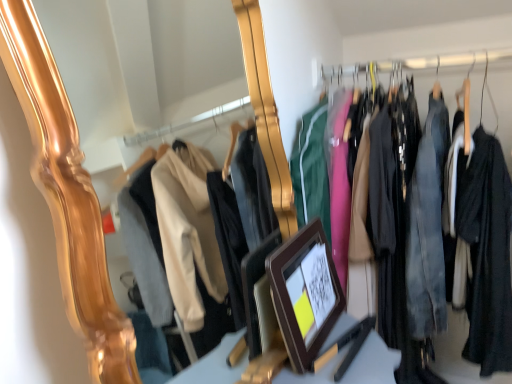
Measure the distance between point (308, 269) and camera.

Point (308, 269) is 1.07 meters from camera.

The image size is (512, 384). Find the location of `brown wooden picture frame at center`. brown wooden picture frame at center is located at coordinates (305, 293).

This screenshot has height=384, width=512. Describe the element at coordinates (305, 293) in the screenshot. I see `brown wooden picture frame at center` at that location.

The height and width of the screenshot is (384, 512). What do you see at coordinates (494, 249) in the screenshot?
I see `matte black jackets at center` at bounding box center [494, 249].

Image resolution: width=512 pixels, height=384 pixels. I want to click on matte black jackets at center, so click(494, 249).

Locate an element on the screen. brown wooden picture frame at center is located at coordinates (305, 293).

Between brown wooden picture frame at center and matte black jackets at center, which one appears on the left side from the viewer's perspective?

From the viewer's perspective, brown wooden picture frame at center appears more on the left side.

In the scene shown: Which is behind, brown wooden picture frame at center or matte black jackets at center?

matte black jackets at center is further from the camera.

Which point is more forward, [304,330] or [502,338]?

The point [304,330] is in front.

Looking at this image, from the image's perspective, is brown wooden picture frame at center located above or below matte black jackets at center?

From the image's perspective, brown wooden picture frame at center appears below matte black jackets at center.

Consider the image. From a real-world perspective, is brown wooden picture frame at center over matte black jackets at center?

No.

Does brown wooden picture frame at center have a lesser width compared to matte black jackets at center?

Indeed, brown wooden picture frame at center has a lesser width compared to matte black jackets at center.

Who is taller, brown wooden picture frame at center or matte black jackets at center?

matte black jackets at center.

Is brown wooden picture frame at center bigger or smaller than matte black jackets at center?

brown wooden picture frame at center is smaller than matte black jackets at center.

Is brown wooden picture frame at center positioned beyond the bounds of matte black jackets at center?

Yes, brown wooden picture frame at center is located beyond the bounds of matte black jackets at center.

Is brown wooden picture frame at center placed right next to matte black jackets at center?

No, brown wooden picture frame at center is not in contact with matte black jackets at center.

Is brown wooden picture frame at center facing away from matte black jackets at center?

No, brown wooden picture frame at center is not facing the opposite direction of matte black jackets at center.

Can you tell me how much brown wooden picture frame at center and matte black jackets at center differ in facing direction?

94.3 degrees.

Measure the distance between brown wooden picture frame at center and matte black jackets at center.

brown wooden picture frame at center is 14.71 inches away from matte black jackets at center.

This screenshot has height=384, width=512. What are the coordinates of `closet lying behind the brown wooden picture frame at center` in the screenshot? It's located at 494,249.

Which object is positioned more to the left, matte black jackets at center or brown wooden picture frame at center?

From the viewer's perspective, brown wooden picture frame at center appears more on the left side.

Which is behind, matte black jackets at center or brown wooden picture frame at center?

matte black jackets at center is further from the camera.

Does point (441, 243) come closer to viewer compared to point (315, 233)?

No.

From the image's perspective, does matte black jackets at center appear lower than brown wooden picture frame at center?

Actually, matte black jackets at center appears above brown wooden picture frame at center in the image.

From a real-world perspective, is matte black jackets at center over brown wooden picture frame at center?

Yes, from a real-world perspective, matte black jackets at center is above brown wooden picture frame at center.

Considering the sizes of objects matte black jackets at center and brown wooden picture frame at center in the image provided, who is thinner, matte black jackets at center or brown wooden picture frame at center?

Thinner between the two is brown wooden picture frame at center.

Between matte black jackets at center and brown wooden picture frame at center, which one has more height?

matte black jackets at center.

Can you confirm if matte black jackets at center is smaller than brown wooden picture frame at center?

Incorrect, matte black jackets at center is not smaller in size than brown wooden picture frame at center.

Do you think matte black jackets at center is within brown wooden picture frame at center, or outside of it?

matte black jackets at center is not inside brown wooden picture frame at center, it's outside.

Are matte black jackets at center and brown wooden picture frame at center far apart?

matte black jackets at center is actually quite close to brown wooden picture frame at center.

Is matte black jackets at center positioned with its back to brown wooden picture frame at center?

That's not correct — matte black jackets at center is not looking away from brown wooden picture frame at center.

Image resolution: width=512 pixels, height=384 pixels. There is a brown wooden picture frame at center. What are the coordinates of `closet above it (from a real-world perspective)` in the screenshot? It's located at (494, 249).

Identify the location of closet above the brown wooden picture frame at center (from a real-world perspective). (494, 249).

Where is `closet above the brown wooden picture frame at center (from the image's perspective)`? This screenshot has height=384, width=512. closet above the brown wooden picture frame at center (from the image's perspective) is located at coordinates (494, 249).